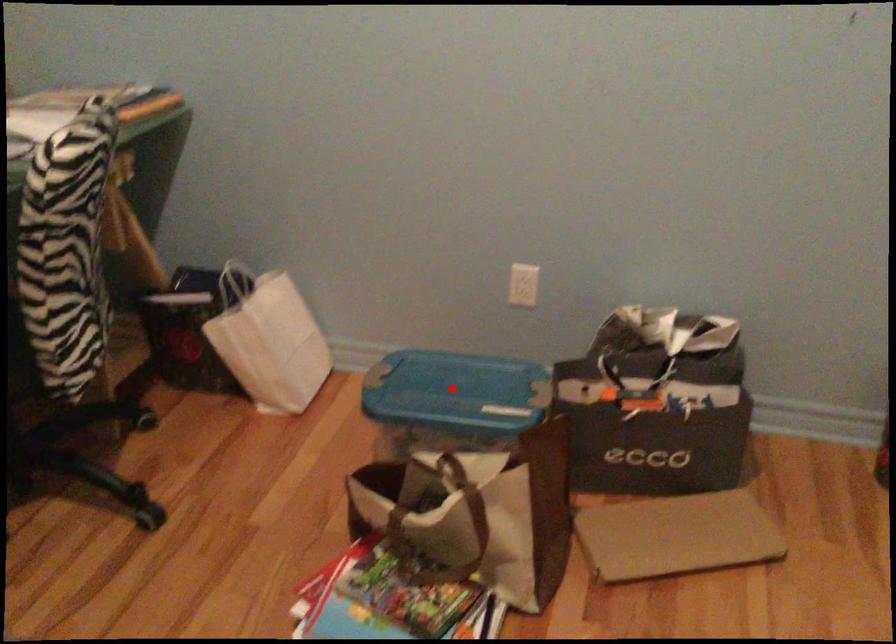
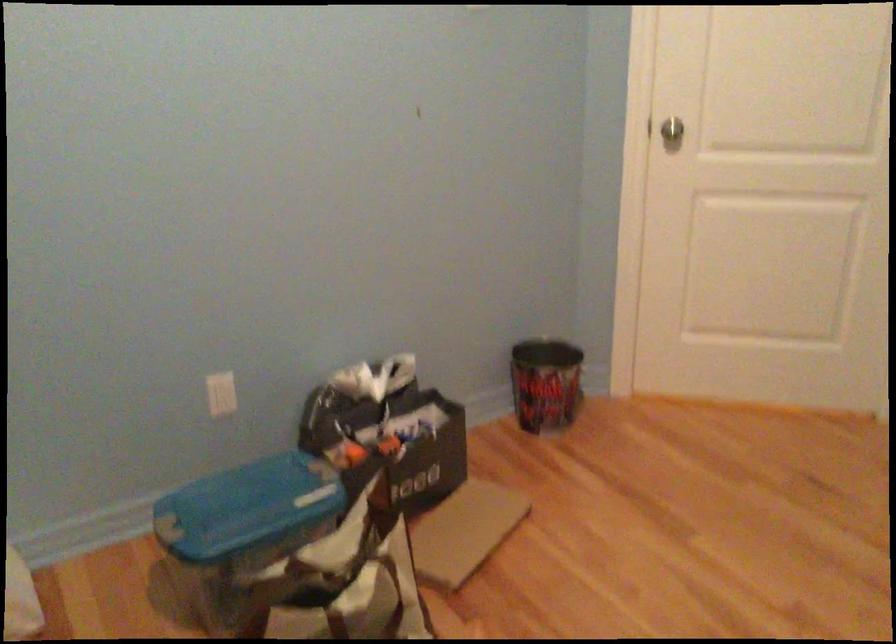
The point at the highlighted location is marked in the first image. Where is the corresponding point in the second image?

(247, 507)